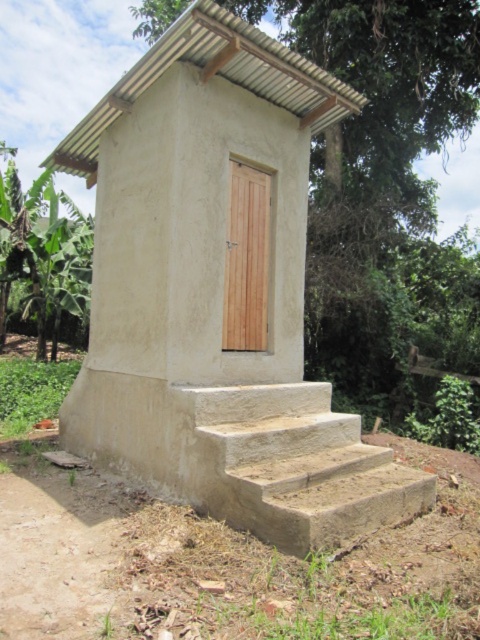
You are standing at the origin point in the image. Which direction should you move to reach the matte concrete hut at center?

The matte concrete hut at center is located at point (216, 294) in the image, so you should move towards the center of the image to reach it.

You are standing at the point marked by point (216, 294) in the image. What structure are you facing?

The point (216, 294) indicates a matte concrete hut at center, so you are facing the matte concrete hut at center.

Looking at this image, you are standing in front of the toilet structure and want to enter. You notice the light brown concrete stairs at lower center and the green leafy banana tree at left. Which object is closer to the entrance of the toilet structure?

The light brown concrete stairs at lower center are closer to the entrance of the toilet structure than the green leafy banana tree at left.